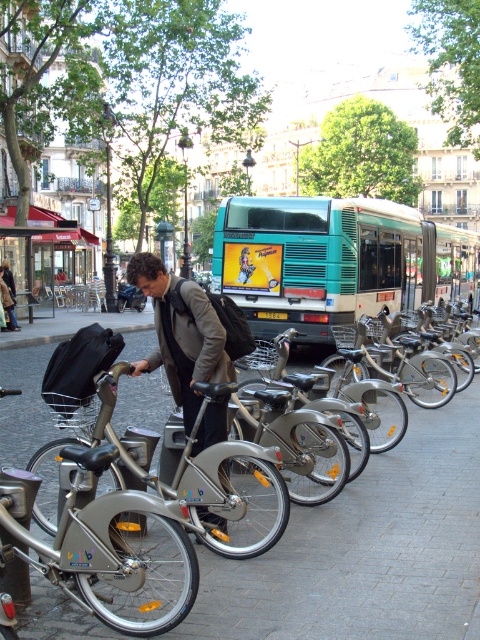
Question: Which of these objects is positioned closest to the silver metallic pavement at center?

Choices:
 (A) silver metallic bicycle at center
 (B) dark brown leather jacket at center
 (C) matte gray jacket at center
 (D) black fabric bag at lower left

Answer: (A)

Question: Can you confirm if teal matte bus at center is bigger than black fabric bag at lower left?

Choices:
 (A) yes
 (B) no

Answer: (A)

Question: Among these objects, which one is farthest from the camera?

Choices:
 (A) black fabric bag at lower left
 (B) dark brown leather jacket at center
 (C) teal matte bus at center
 (D) silver metallic bicycle at center

Answer: (B)

Question: Which point is closer to the camera?

Choices:
 (A) black fabric bag at lower left
 (B) dark brown leather jacket at center
 (C) teal matte bus at center
 (D) matte gray jacket at center

Answer: (D)

Question: Is silver metallic pavement at center positioned before silver metallic bicycle at center?

Choices:
 (A) yes
 (B) no

Answer: (A)

Question: Does teal matte bus at center appear on the right side of silver metallic bicycle at center?

Choices:
 (A) yes
 (B) no

Answer: (A)